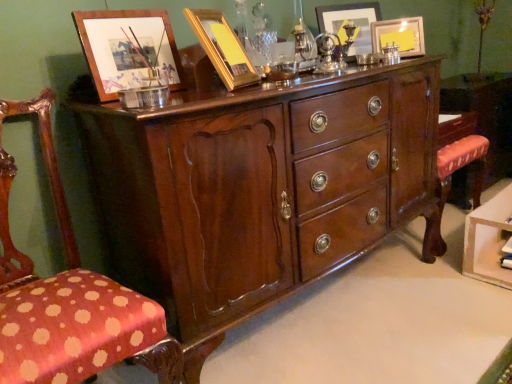
Identify the location of polka dot fabric chair at left. (69, 297).

In order to face polka dot fabric chair at left, should I rotate leftwards or rightwards?

It's best to rotate left around 25.000 degrees.

Measure the distance between point (416, 49) and camera.

The depth of point (416, 49) is 5.57 feet.

The image size is (512, 384). Describe the element at coordinates (261, 189) in the screenshot. I see `shiny brown wood chest of drawers at center` at that location.

Locate an element on the screen. Image resolution: width=512 pixels, height=384 pixels. gold metallic picture frame at upper center, acting as the 3th picture frame starting from the back is located at coordinates (222, 48).

The height and width of the screenshot is (384, 512). Identify the location of wooden picture frame at upper left, which is counted as the first picture frame, starting from the front. (128, 49).

I want to click on chair in front of the gold metallic picture frame at upper center, which is the second picture frame in front-to-back order, so click(69, 297).

Is polka dot fabric chair at left positioned far away from gold metallic picture frame at upper center, arranged as the 2th picture frame when viewed from the left?

No, polka dot fabric chair at left is not far away from gold metallic picture frame at upper center, arranged as the 2th picture frame when viewed from the left.

Does polka dot fabric chair at left turn towards gold metallic picture frame at upper center, which is the second picture frame in front-to-back order?

No, polka dot fabric chair at left is not aimed at gold metallic picture frame at upper center, which is the second picture frame in front-to-back order.

From the image's perspective, which is below, polka dot fabric chair at left or gold metallic picture frame at upper center, the third picture frame in the right-to-left sequence?

polka dot fabric chair at left, from the image's perspective.

Looking at this image, is shiny brown wood chest of drawers at center to the left of polka dot fabric chair at left from the viewer's perspective?

Incorrect, shiny brown wood chest of drawers at center is not on the left side of polka dot fabric chair at left.

Is polka dot fabric chair at left at the back of shiny brown wood chest of drawers at center?

No, polka dot fabric chair at left is not at the back of shiny brown wood chest of drawers at center.

How distant is shiny brown wood chest of drawers at center from polka dot fabric chair at left?

shiny brown wood chest of drawers at center and polka dot fabric chair at left are 19.18 inches apart from each other.

Who is taller, shiny brown wood chest of drawers at center or polka dot fabric chair at left?

polka dot fabric chair at left.

Does shiny brown wood chest of drawers at center lie behind gold metallic picture frame at upper center, the third picture frame in the right-to-left sequence?

No, shiny brown wood chest of drawers at center is closer to the viewer.

From a real-world perspective, which is physically below, shiny brown wood chest of drawers at center or gold metallic picture frame at upper center, which is the second picture frame in front-to-back order?

shiny brown wood chest of drawers at center.

In terms of height, does shiny brown wood chest of drawers at center look taller or shorter compared to gold metallic picture frame at upper center, which is the second picture frame in front-to-back order?

Considering their sizes, shiny brown wood chest of drawers at center has more height than gold metallic picture frame at upper center, which is the second picture frame in front-to-back order.

Which is behind, point (153, 141) or point (203, 42)?

Positioned behind is point (203, 42).

From the image's perspective, is matte gold picture frame at upper right, placed as the 4th picture frame when sorted from left to right, located above or below matte gold picture frame at upper center, the 3th picture frame from the left?

Clearly, from the image's perspective, matte gold picture frame at upper right, placed as the 4th picture frame when sorted from left to right, is below matte gold picture frame at upper center, the 3th picture frame from the left.

Between matte gold picture frame at upper right, which appears as the 3th picture frame when viewed from the front, and matte gold picture frame at upper center, the 3th picture frame from the left, which one has smaller width?

Thinner between the two is matte gold picture frame at upper right, which appears as the 3th picture frame when viewed from the front.

Does matte gold picture frame at upper right, which appears as the 3th picture frame when viewed from the front, turn towards matte gold picture frame at upper center, the second picture frame from the right?

No, matte gold picture frame at upper right, which appears as the 3th picture frame when viewed from the front, is not aimed at matte gold picture frame at upper center, the second picture frame from the right.

Considering the positions of point (376, 24) and point (338, 22), is point (376, 24) closer or farther from the camera than point (338, 22)?

Point (376, 24) is positioned closer to the camera compared to point (338, 22).

How far apart are wooden picture frame at upper left, the 1th picture frame from the left, and mahogany wood vanity at right?

They are 1.59 meters apart.

Is mahogany wood vanity at right completely or partially inside wooden picture frame at upper left, arranged as the 4th picture frame when viewed from the back?

That's incorrect, mahogany wood vanity at right is not inside wooden picture frame at upper left, arranged as the 4th picture frame when viewed from the back.

Between wooden picture frame at upper left, acting as the 4th picture frame starting from the right, and mahogany wood vanity at right, which one has smaller width?

With smaller width is wooden picture frame at upper left, acting as the 4th picture frame starting from the right.

Is wooden picture frame at upper left, which is counted as the first picture frame, starting from the front, facing away from mahogany wood vanity at right?

wooden picture frame at upper left, which is counted as the first picture frame, starting from the front, does not have its back to mahogany wood vanity at right.

Does mahogany wood vanity at right turn towards polka dot fabric chair at left?

No, mahogany wood vanity at right is not turned towards polka dot fabric chair at left.

How distant is mahogany wood vanity at right from polka dot fabric chair at left?

A distance of 1.89 meters exists between mahogany wood vanity at right and polka dot fabric chair at left.

From the image's perspective, is mahogany wood vanity at right on polka dot fabric chair at left?

Indeed, from the image's perspective, mahogany wood vanity at right is shown above polka dot fabric chair at left.

Does point (463, 176) come closer to viewer compared to point (95, 334)?

No, (463, 176) is further to viewer.

Between mahogany wood vanity at right and wooden picture frame at upper left, the 1th picture frame from the left, which one appears on the left side from the viewer's perspective?

wooden picture frame at upper left, the 1th picture frame from the left.

Between mahogany wood vanity at right and wooden picture frame at upper left, which is counted as the first picture frame, starting from the front, which one has more height?

mahogany wood vanity at right is taller.

Considering the points (488, 73) and (126, 56), which point is behind, point (488, 73) or point (126, 56)?

The point (488, 73) is behind.

Could you tell me if mahogany wood vanity at right is turned towards wooden picture frame at upper left, the 1th picture frame from the left?

No, mahogany wood vanity at right is not oriented towards wooden picture frame at upper left, the 1th picture frame from the left.

This screenshot has width=512, height=384. Identify the location of chair in front of the gold metallic picture frame at upper center, acting as the 3th picture frame starting from the back. (69, 297).

Identify the location of the chest of drawers above the polka dot fabric chair at left (from the image's perspective). (261, 189).

When comparing their distances from shiny brown wood chest of drawers at center, does matte gold picture frame at upper right, which appears as the 3th picture frame when viewed from the front, or mahogany wood vanity at right seem further?

The object further to shiny brown wood chest of drawers at center is mahogany wood vanity at right.

Estimate the real-world distances between objects in this image. Which object is closer to mahogany wood vanity at right, matte gold picture frame at upper right, which appears as the first picture frame when viewed from the right, or matte gold picture frame at upper center, the fourth picture frame in the front-to-back sequence?

matte gold picture frame at upper right, which appears as the first picture frame when viewed from the right, is closer to mahogany wood vanity at right.

Considering their positions, is polka dot fabric chair at left positioned further to matte gold picture frame at upper right, which is the second picture frame from back to front, than shiny brown wood chest of drawers at center?

polka dot fabric chair at left is positioned further to the anchor matte gold picture frame at upper right, which is the second picture frame from back to front.

Based on their spatial positions, is mahogany wood vanity at right or matte gold picture frame at upper center, the fourth picture frame in the front-to-back sequence, closer to wooden picture frame at upper left, which is counted as the first picture frame, starting from the front?

matte gold picture frame at upper center, the fourth picture frame in the front-to-back sequence, is closer to wooden picture frame at upper left, which is counted as the first picture frame, starting from the front.

Which object lies further to the anchor point gold metallic picture frame at upper center, the third picture frame in the right-to-left sequence, matte gold picture frame at upper center, arranged as the 1th picture frame when viewed from the back, or matte gold picture frame at upper right, placed as the 4th picture frame when sorted from left to right?

matte gold picture frame at upper right, placed as the 4th picture frame when sorted from left to right, is positioned further to the anchor gold metallic picture frame at upper center, the third picture frame in the right-to-left sequence.

Looking at this image, which object lies nearer to the anchor point mahogany wood vanity at right, wooden picture frame at upper left, arranged as the 4th picture frame when viewed from the back, or shiny brown wood chest of drawers at center?

Based on the image, shiny brown wood chest of drawers at center appears to be nearer to mahogany wood vanity at right.

From the image, which object appears to be farther from shiny brown wood chest of drawers at center, wooden picture frame at upper left, acting as the 4th picture frame starting from the right, or polka dot fabric chair at left?

Among the two, polka dot fabric chair at left is located further to shiny brown wood chest of drawers at center.

When comparing their distances from mahogany wood vanity at right, does wooden picture frame at upper left, which is counted as the first picture frame, starting from the front, or gold metallic picture frame at upper center, the third picture frame in the right-to-left sequence, seem further?

Among the two, wooden picture frame at upper left, which is counted as the first picture frame, starting from the front, is located further to mahogany wood vanity at right.

The width and height of the screenshot is (512, 384). What are the coordinates of `picture frame between gold metallic picture frame at upper center, the third picture frame in the right-to-left sequence, and polka dot fabric chair at left from top to bottom` in the screenshot? It's located at (128, 49).

Locate an element on the screen. The height and width of the screenshot is (384, 512). chest of drawers between gold metallic picture frame at upper center, arranged as the 2th picture frame when viewed from the left, and polka dot fabric chair at left from top to bottom is located at coordinates (261, 189).

Where is `the chest of drawers located between polka dot fabric chair at left and matte gold picture frame at upper right, which appears as the 3th picture frame when viewed from the front, in the left-right direction`? the chest of drawers located between polka dot fabric chair at left and matte gold picture frame at upper right, which appears as the 3th picture frame when viewed from the front, in the left-right direction is located at coordinates (261, 189).

Image resolution: width=512 pixels, height=384 pixels. What are the coordinates of `chest of drawers between polka dot fabric chair at left and mahogany wood vanity at right in the horizontal direction` in the screenshot? It's located at (261, 189).